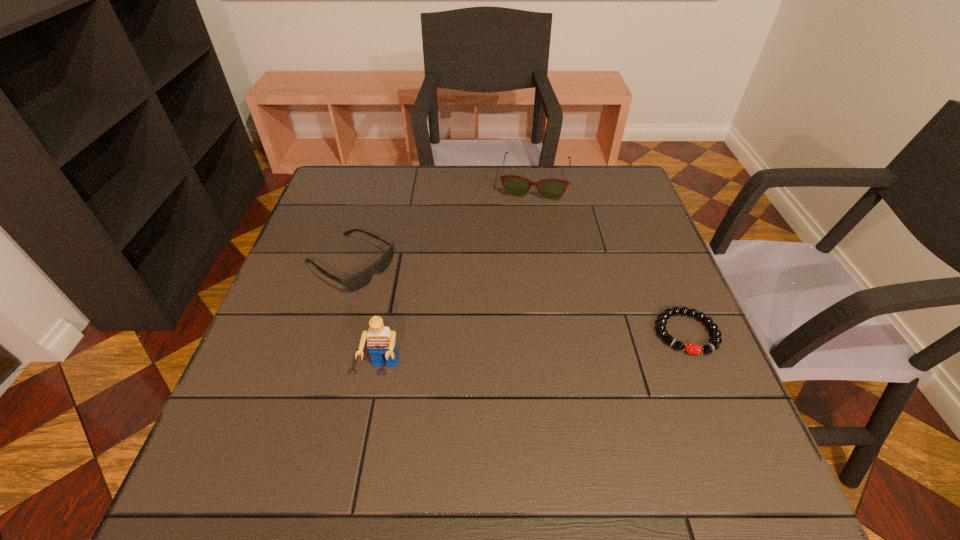
Where is `vacant area that lies between the third object from left to right and the tallest object`? Image resolution: width=960 pixels, height=540 pixels. vacant area that lies between the third object from left to right and the tallest object is located at coordinates (459, 276).

I want to click on vacant region between the third shortest object and the second farthest object, so click(x=443, y=224).

Identify which object is the second nearest to the shortest object. Please provide its 2D coordinates. Your answer should be formatted as a tuple, i.e. [(x, y)], where the tuple contains the x and y coordinates of a point satisfying the conditions above.

[(381, 343)]

Where is `the third closest object to the bracelet`? The image size is (960, 540). the third closest object to the bracelet is located at coordinates (353, 283).

Locate an element on the screen. The height and width of the screenshot is (540, 960). free region that satisfies the following two spatial constraints: 1. on the front side of the second farthest object; 2. on the left side of the rightmost object is located at coordinates (329, 333).